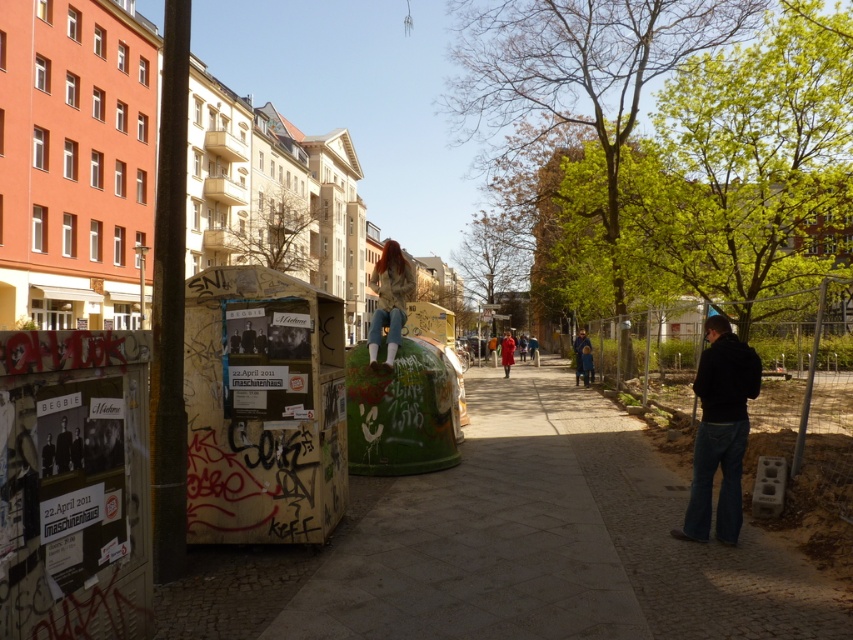
Is black cotton hoodie at lower right smaller than red fabric coat at center?

Yes.

Based on the photo, who is shorter, black cotton hoodie at lower right or red fabric coat at center?

Standing shorter between the two is red fabric coat at center.

Who is more forward, [733,396] or [505,330]?

Point [733,396]

The width and height of the screenshot is (853, 640). Find the location of `black cotton hoodie at lower right`. black cotton hoodie at lower right is located at coordinates (720, 432).

Can you confirm if black cotton hoodie at lower right is taller than light brown leather jacket at center?

Yes, black cotton hoodie at lower right is taller than light brown leather jacket at center.

Is black cotton hoodie at lower right closer to the viewer compared to light brown leather jacket at center?

Yes, it is in front of light brown leather jacket at center.

Based on the photo, measure the distance between black cotton hoodie at lower right and camera.

black cotton hoodie at lower right is 5.30 meters away from camera.

I want to click on black cotton hoodie at lower right, so click(720, 432).

How far apart are blue denim jeans at center and red fabric coat at center?

blue denim jeans at center is 5.76 meters away from red fabric coat at center.

Does blue denim jeans at center lie in front of red fabric coat at center?

Yes.

Who is more distant from viewer, (x=589, y=346) or (x=503, y=349)?

The point (x=503, y=349) is more distant.

Image resolution: width=853 pixels, height=640 pixels. What are the coordinates of `blue denim jeans at center` in the screenshot? It's located at (579, 355).